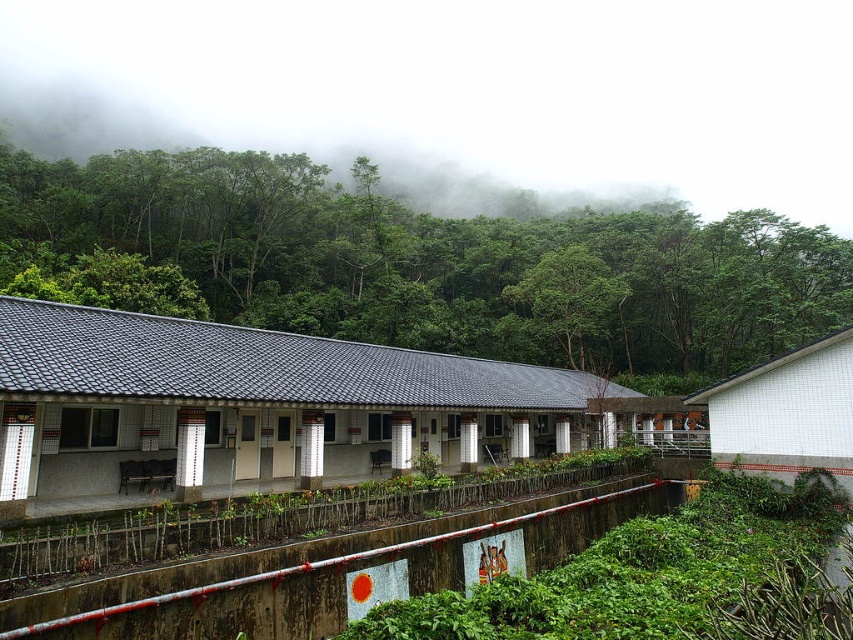
Between point (132, 259) and point (618, 300), which one is positioned behind?

The point (618, 300) is more distant.

Locate an element on the screen. green leafy trees at upper center is located at coordinates (416, 262).